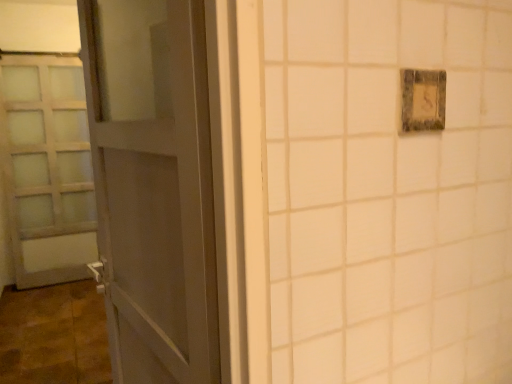
Question: Does rustic wood light switch at upper right touch satin white door at left, which is counted as the second door, starting from the front?

Choices:
 (A) yes
 (B) no

Answer: (B)

Question: From a real-world perspective, does rustic wood light switch at upper right sit lower than satin white door at left, the 1th door viewed from the back?

Choices:
 (A) yes
 (B) no

Answer: (B)

Question: Is there a large distance between rustic wood light switch at upper right and satin white door at left, which is counted as the second door, starting from the front?

Choices:
 (A) no
 (B) yes

Answer: (B)

Question: Is satin white door at left, the 1th door viewed from the back, at the back of rustic wood light switch at upper right?

Choices:
 (A) no
 (B) yes

Answer: (B)

Question: From a real-world perspective, is rustic wood light switch at upper right on top of satin white door at left, the 1th door viewed from the back?

Choices:
 (A) yes
 (B) no

Answer: (A)

Question: In the image, is matte gray door at left, the first door positioned from the front, positioned in front of or behind satin white door at left, the 1th door viewed from the back?

Choices:
 (A) behind
 (B) front

Answer: (B)

Question: Considering the positions of point (151, 36) and point (44, 271), is point (151, 36) closer or farther from the camera than point (44, 271)?

Choices:
 (A) closer
 (B) farther

Answer: (A)

Question: From a real-world perspective, relative to satin white door at left, the second door in the right-to-left sequence, is matte gray door at left, which is the 1th door in right-to-left order, vertically above or below?

Choices:
 (A) above
 (B) below

Answer: (A)

Question: Considering the positions of matte gray door at left, the 2th door viewed from the left, and satin white door at left, the second door in the right-to-left sequence, in the image, is matte gray door at left, the 2th door viewed from the left, wider or thinner than satin white door at left, the second door in the right-to-left sequence,?

Choices:
 (A) wide
 (B) thin

Answer: (A)

Question: Is satin white door at left, the 1th door viewed from the left, taller or shorter than rustic wood light switch at upper right?

Choices:
 (A) short
 (B) tall

Answer: (B)

Question: In terms of width, does satin white door at left, the second door in the right-to-left sequence, look wider or thinner when compared to rustic wood light switch at upper right?

Choices:
 (A) wide
 (B) thin

Answer: (A)

Question: Is satin white door at left, the 1th door viewed from the back, bigger or smaller than rustic wood light switch at upper right?

Choices:
 (A) small
 (B) big

Answer: (B)

Question: Considering the positions of point (25, 281) and point (418, 92), is point (25, 281) closer or farther from the camera than point (418, 92)?

Choices:
 (A) farther
 (B) closer

Answer: (A)

Question: Which is correct: rustic wood light switch at upper right is inside satin white door at left, which is counted as the second door, starting from the front, or outside of it?

Choices:
 (A) outside
 (B) inside

Answer: (A)

Question: Looking at their shapes, would you say rustic wood light switch at upper right is wider or thinner than satin white door at left, the 1th door viewed from the left?

Choices:
 (A) thin
 (B) wide

Answer: (A)